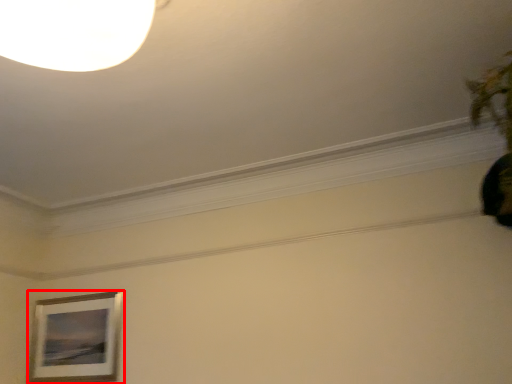
Question: From the image's perspective, where is picture frame (annotated by the red box) located in relation to plant in the image?

Choices:
 (A) below
 (B) above

Answer: (A)